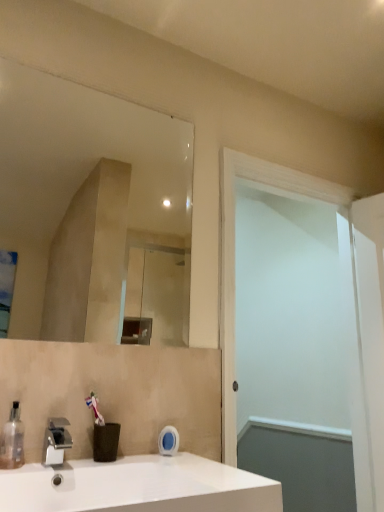
Question: Is white glossy sink at lower left facing towards clear glass mirror at upper center?

Choices:
 (A) yes
 (B) no

Answer: (B)

Question: Can you confirm if white glossy sink at lower left is shorter than clear glass mirror at upper center?

Choices:
 (A) no
 (B) yes

Answer: (B)

Question: Is white glossy sink at lower left positioned beyond the bounds of clear glass mirror at upper center?

Choices:
 (A) yes
 (B) no

Answer: (A)

Question: Is white glossy sink at lower left smaller than clear glass mirror at upper center?

Choices:
 (A) yes
 (B) no

Answer: (B)

Question: From a real-world perspective, is white glossy sink at lower left physically above clear glass mirror at upper center?

Choices:
 (A) no
 (B) yes

Answer: (A)

Question: Does white glossy sink at lower left appear on the left side of clear glass mirror at upper center?

Choices:
 (A) yes
 (B) no

Answer: (B)

Question: Is white matte screen door at right wider than white glossy sink at lower left?

Choices:
 (A) no
 (B) yes

Answer: (A)

Question: Would you consider white matte screen door at right to be distant from white glossy sink at lower left?

Choices:
 (A) yes
 (B) no

Answer: (B)

Question: Is white matte screen door at right placed right next to white glossy sink at lower left?

Choices:
 (A) no
 (B) yes

Answer: (A)

Question: Is the position of white matte screen door at right more distant than that of white glossy sink at lower left?

Choices:
 (A) no
 (B) yes

Answer: (B)

Question: Is white glossy sink at lower left at the back of white matte screen door at right?

Choices:
 (A) no
 (B) yes

Answer: (A)

Question: From a real-world perspective, does white matte screen door at right sit lower than white glossy sink at lower left?

Choices:
 (A) yes
 (B) no

Answer: (B)

Question: Can you confirm if silver metallic faucet at lower left is positioned to the right of white matte screen door at right?

Choices:
 (A) no
 (B) yes

Answer: (A)